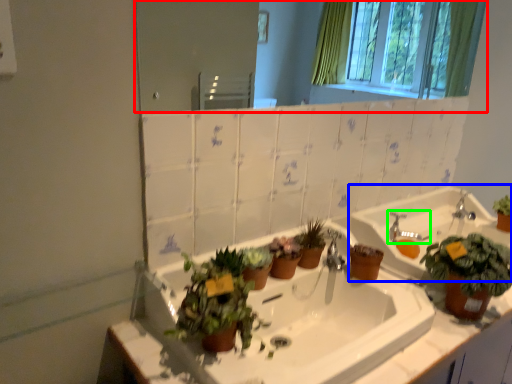
Question: Considering the real-world distances, which object is farthest from mirror (highlighted by a red box)? sink (highlighted by a blue box) or faucet (highlighted by a green box)?

Choices:
 (A) sink
 (B) faucet

Answer: (B)